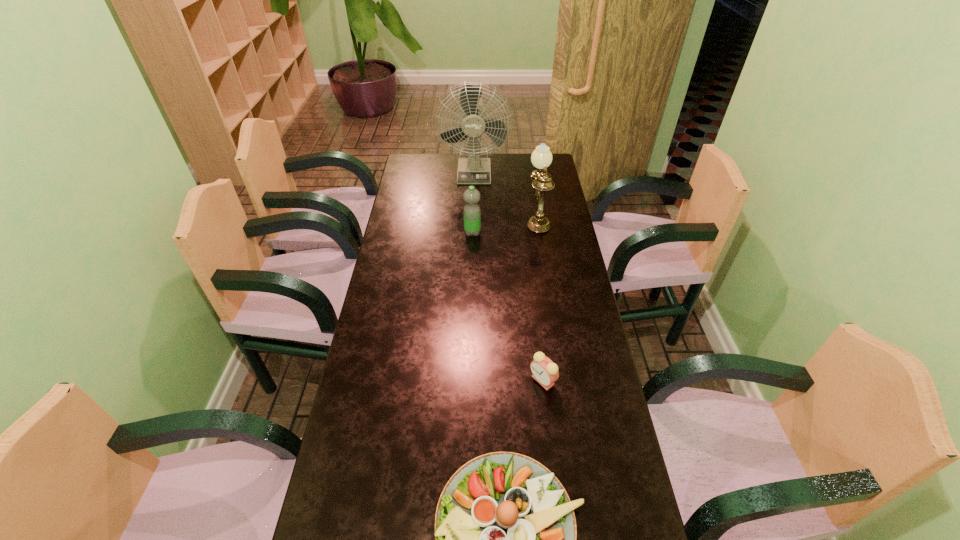
Image resolution: width=960 pixels, height=540 pixels. What are the coordinates of `free space located on the face of the alarm clock` in the screenshot? It's located at (415, 380).

At what (x,y) coordinates should I click in order to perform the action: click on object present at the far edge. Please return your answer as a coordinate pair (x, y). This screenshot has width=960, height=540. Looking at the image, I should click on (473, 170).

Identify the location of oil lamp that is at the right edge. The image size is (960, 540). (541, 158).

Find the location of a particular element. Image resolution: width=960 pixels, height=540 pixels. alarm clock that is at the right edge is located at coordinates (545, 372).

Locate an element on the screen. This screenshot has width=960, height=540. vacant area at the far edge is located at coordinates (515, 153).

Find the location of a particular element. free space at the left edge of the desktop is located at coordinates (393, 243).

Find the location of a particular element. The height and width of the screenshot is (540, 960). vacant position at the far left corner of the desktop is located at coordinates (427, 167).

This screenshot has height=540, width=960. What are the coordinates of `vacant space at the far right corner of the desktop` in the screenshot? It's located at (523, 169).

Where is `free spot between the third tallest object and the second tallest object`? free spot between the third tallest object and the second tallest object is located at coordinates (505, 225).

Identify which object is the fourth closest to the fan. Please provide its 2D coordinates. Your answer should be formatted as a tuple, i.e. [(x, y)], where the tuple contains the x and y coordinates of a point satisfying the conditions above.

[(506, 535)]